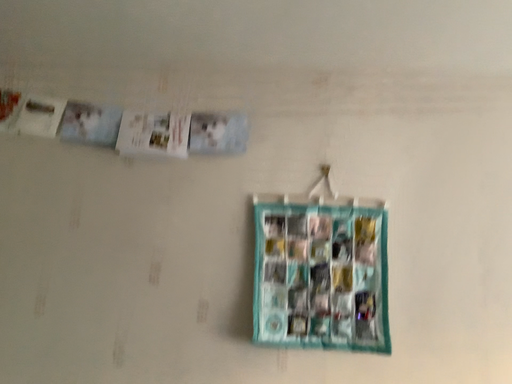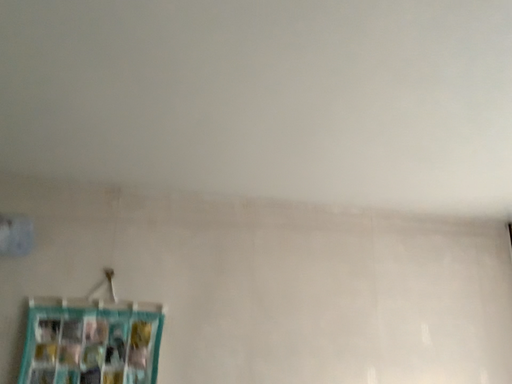
Question: How did the camera likely rotate when shooting the video?

Choices:
 (A) rotated left
 (B) rotated right

Answer: (B)